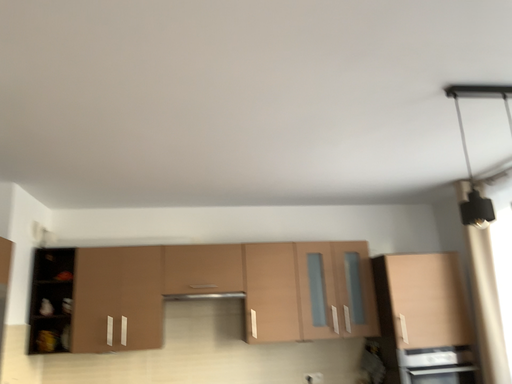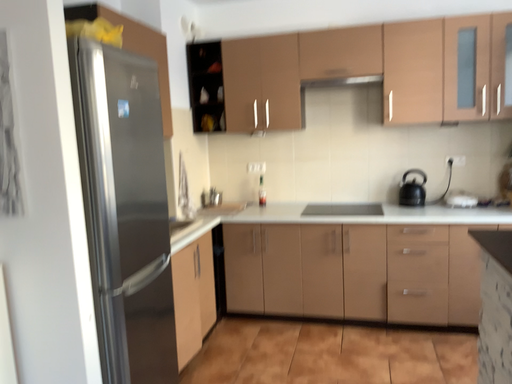
Question: How did the camera likely rotate when shooting the video?

Choices:
 (A) rotated left
 (B) rotated right

Answer: (A)